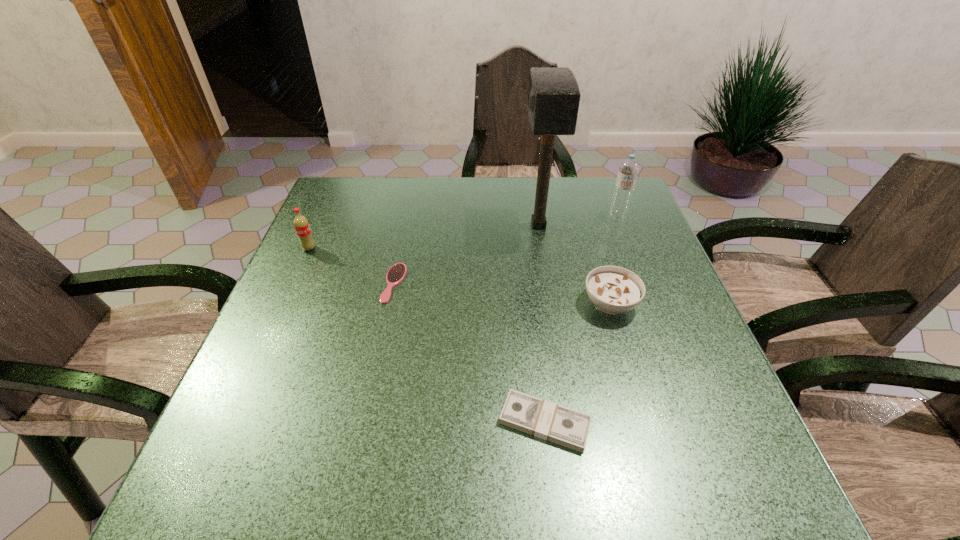
In order to click on object located at the far right corner in this screenshot , I will do `click(628, 170)`.

Identify the location of free space at the far edge of the desktop. (548, 196).

Where is `vacant space at the near edge`? vacant space at the near edge is located at coordinates (364, 507).

Find the location of `free space at the left edge of the desktop`. free space at the left edge of the desktop is located at coordinates (277, 355).

Where is `free space at the right edge`? This screenshot has height=540, width=960. free space at the right edge is located at coordinates (625, 231).

This screenshot has width=960, height=540. Identify the location of vacant space at the near left corner of the desktop. (247, 484).

The height and width of the screenshot is (540, 960). Find the location of `unoccupied area between the mallet and the soda`. unoccupied area between the mallet and the soda is located at coordinates (423, 237).

Where is `empty space between the hairbrush and the soup bowl`? empty space between the hairbrush and the soup bowl is located at coordinates (502, 293).

Where is `free point between the dollar and the tallest object`? This screenshot has height=540, width=960. free point between the dollar and the tallest object is located at coordinates coord(541,323).

The image size is (960, 540). Find the location of `free spot between the second tallest object and the leftmost object`. free spot between the second tallest object and the leftmost object is located at coordinates (463, 232).